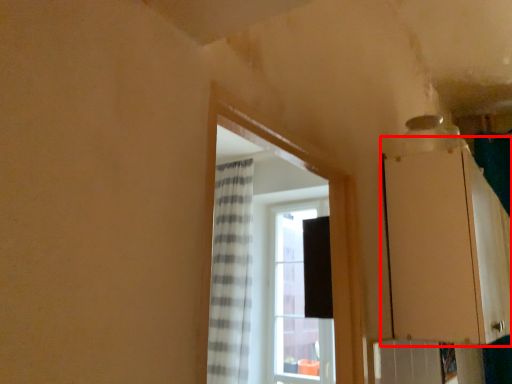
Question: From the image's perspective, considering the relative positions of cabinetry (annotated by the red box) and window in the image provided, where is cabinetry (annotated by the red box) located with respect to the staircase?

Choices:
 (A) above
 (B) below

Answer: (B)